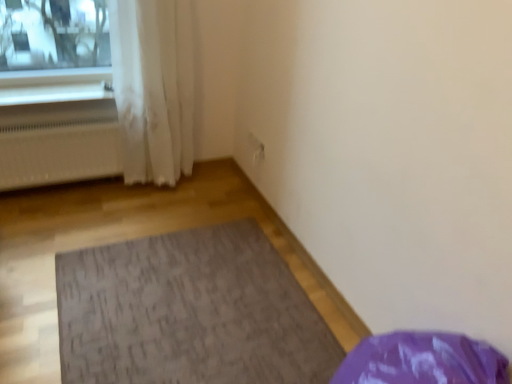
What do you see at coordinates (153, 87) in the screenshot? This screenshot has height=384, width=512. I see `white sheer curtain at left` at bounding box center [153, 87].

Measure the distance between point (33, 99) and camera.

Point (33, 99) and camera are 2.10 meters apart from each other.

Locate an element on the screen. textured gray mat at center is located at coordinates (189, 312).

From a real-world perspective, which is physically below, white matte radiator at left or white sheer curtain at left?

white matte radiator at left, from a real-world perspective.

Considering the sizes of white matte radiator at left and white sheer curtain at left in the image, is white matte radiator at left bigger or smaller than white sheer curtain at left?

Considering their sizes, white matte radiator at left takes up less space than white sheer curtain at left.

What's the angular difference between white matte radiator at left and white sheer curtain at left's facing directions?

0.121 degrees separate the facing orientations of white matte radiator at left and white sheer curtain at left.

Is white matte radiator at left facing towards white sheer curtain at left?

No, white matte radiator at left is not facing towards white sheer curtain at left.

Is textured gray mat at center bigger than white matte radiator at left?

No, textured gray mat at center is not bigger than white matte radiator at left.

Is point (205, 300) positioned in front of point (75, 171)?

Yes, it is in front of point (75, 171).

Is textured gray mat at center in front of or behind white matte radiator at left in the image?

In the image, textured gray mat at center appears in front of white matte radiator at left.

Would you say textured gray mat at center is a long distance from white matte radiator at left?

textured gray mat at center is actually quite close to white matte radiator at left.

From the image's perspective, is white sheer curtain at left over white plastic window sill at upper left?

No.

From a real-world perspective, is white sheer curtain at left physically located above or below white plastic window sill at upper left?

white sheer curtain at left is situated higher than white plastic window sill at upper left in the real world.

Which is behind, white sheer curtain at left or white plastic window sill at upper left?

white plastic window sill at upper left is further away from the camera.

Considering the sizes of white sheer curtain at left and white plastic window sill at upper left in the image, is white sheer curtain at left bigger or smaller than white plastic window sill at upper left?

Considering their sizes, white sheer curtain at left takes up more space than white plastic window sill at upper left.

Which of these two, white matte radiator at left or textured gray mat at center, is smaller?

With smaller size is textured gray mat at center.

Between white matte radiator at left and textured gray mat at center, which one has more height?

Standing taller between the two is white matte radiator at left.

Who is bigger, white sheer curtain at left or textured gray mat at center?

Bigger between the two is white sheer curtain at left.

Which is in front, white sheer curtain at left or textured gray mat at center?

Positioned in front is textured gray mat at center.

Is white sheer curtain at left positioned far away from textured gray mat at center?

That's not correct — white sheer curtain at left is a little close to textured gray mat at center.

Is textured gray mat at center positioned far away from white plastic window sill at upper left?

That's right, there is a large distance between textured gray mat at center and white plastic window sill at upper left.

Is textured gray mat at center taller than white plastic window sill at upper left?

No.

I want to click on window sill that appears on the left of textured gray mat at center, so pyautogui.click(x=54, y=94).

Can you confirm if textured gray mat at center is bigger than white sheer curtain at left?

No, textured gray mat at center is not bigger than white sheer curtain at left.

Considering the positions of objects textured gray mat at center and white sheer curtain at left in the image provided, who is behind, textured gray mat at center or white sheer curtain at left?

white sheer curtain at left is further from the camera.

Does textured gray mat at center have a greater width compared to white sheer curtain at left?

Indeed, textured gray mat at center has a greater width compared to white sheer curtain at left.

From the image's perspective, which object appears higher, textured gray mat at center or white sheer curtain at left?

white sheer curtain at left appears higher in the image.

Find the location of a particular element. This screenshot has width=512, height=384. radiator that appears on the left of white sheer curtain at left is located at coordinates (59, 154).

Identify the location of mat to the right of white matte radiator at left. The height and width of the screenshot is (384, 512). (189, 312).

When comparing their distances from white plastic window sill at upper left, does white matte radiator at left or white sheer curtain at left seem further?

The object further to white plastic window sill at upper left is white sheer curtain at left.

From the image, which object appears to be nearer to textured gray mat at center, white sheer curtain at left or white matte radiator at left?

white sheer curtain at left is positioned closer to the anchor textured gray mat at center.

Based on their spatial positions, is textured gray mat at center or white plastic window sill at upper left further from white sheer curtain at left?

textured gray mat at center lies further to white sheer curtain at left than the other object.

Estimate the real-world distances between objects in this image. Which object is further from white plastic window sill at upper left, textured gray mat at center or white sheer curtain at left?

textured gray mat at center is further to white plastic window sill at upper left.

Which object lies nearer to the anchor point textured gray mat at center, white plastic window sill at upper left or white matte radiator at left?

The object closer to textured gray mat at center is white matte radiator at left.

Looking at the image, which one is located closer to white matte radiator at left, white plastic window sill at upper left or textured gray mat at center?

Based on the image, white plastic window sill at upper left appears to be nearer to white matte radiator at left.

Based on their spatial positions, is white sheer curtain at left or white matte radiator at left closer to white plastic window sill at upper left?

The object closer to white plastic window sill at upper left is white matte radiator at left.

Estimate the real-world distances between objects in this image. Which object is closer to white matte radiator at left, textured gray mat at center or white plastic window sill at upper left?

white plastic window sill at upper left is closer to white matte radiator at left.

Locate an element on the screen. This screenshot has height=384, width=512. curtain between white plastic window sill at upper left and textured gray mat at center from top to bottom is located at coordinates (153, 87).

You are a GUI agent. You are given a task and a screenshot of the screen. Output one action in this format:
    pyautogui.click(x=<x>, y=<y>)
    Task: Click on the window sill between white matte radiator at left and white sheer curtain at left from left to right
    This screenshot has height=384, width=512.
    Given the screenshot: What is the action you would take?
    pyautogui.click(x=54, y=94)

Identify the location of radiator between white sheer curtain at left and textured gray mat at center from top to bottom. (59, 154).

At what (x,y) coordinates should I click in order to perform the action: click on radiator between white plastic window sill at upper left and textured gray mat at center in the up-down direction. Please return your answer as a coordinate pair (x, y). Image resolution: width=512 pixels, height=384 pixels. Looking at the image, I should click on (59, 154).